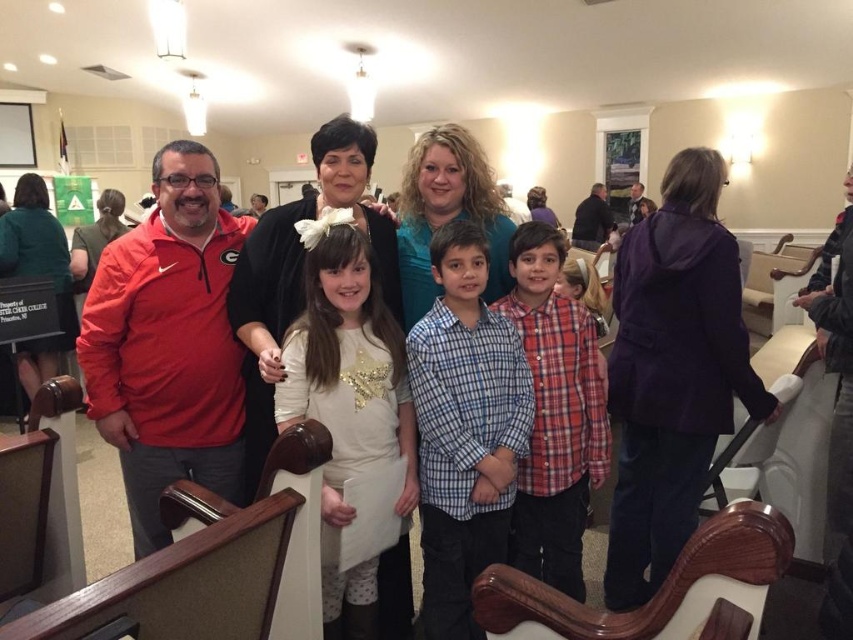
Question: Does blue plaid shirt at center have a larger size compared to white sequined dress at center?

Choices:
 (A) no
 (B) yes

Answer: (A)

Question: Which object is closer to the camera taking this photo?

Choices:
 (A) white sequined dress at center
 (B) plaid shirt at center

Answer: (A)

Question: Considering the relative positions of white sequined dress at center and plaid shirt at center in the image provided, where is white sequined dress at center located with respect to plaid shirt at center?

Choices:
 (A) below
 (B) above

Answer: (A)

Question: Which of the following is the farthest from the observer?

Choices:
 (A) white sequined dress at center
 (B) plaid shirt at center

Answer: (B)

Question: Which point is farther to the camera?

Choices:
 (A) white sequined dress at center
 (B) plaid shirt at center

Answer: (B)

Question: Is blue plaid shirt at center smaller than plaid shirt at center?

Choices:
 (A) yes
 (B) no

Answer: (A)